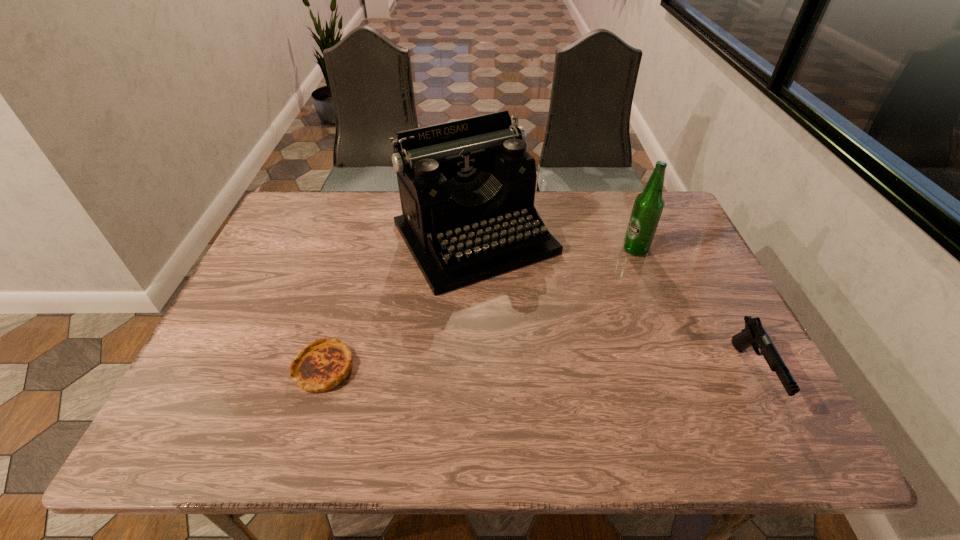
You are a GUI agent. You are given a task and a screenshot of the screen. Output one action in this format:
    pyautogui.click(x=<x>, y=<y>)
    Task: Click on the vacant spot on the desktop that is between the quiche and the rightmost object and is positioned on the typing side of the typewriter
    This screenshot has height=540, width=960.
    Given the screenshot: What is the action you would take?
    pyautogui.click(x=574, y=371)

Where is `vacant space on the desktop that is between the quiche and the second shortest object and is positioned on the label of the beer bottle`? Image resolution: width=960 pixels, height=540 pixels. vacant space on the desktop that is between the quiche and the second shortest object and is positioned on the label of the beer bottle is located at coordinates (592, 372).